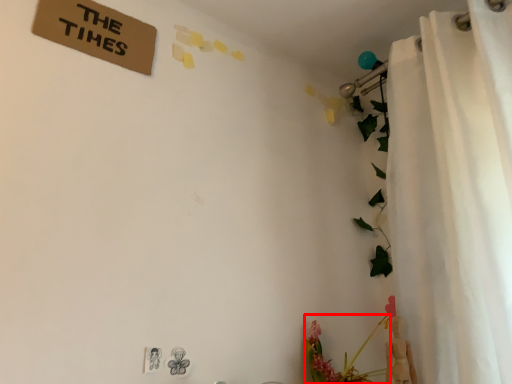
Question: From the image's perspective, where is floral arrangement (annotated by the red box) located relative to curtain?

Choices:
 (A) above
 (B) below

Answer: (B)